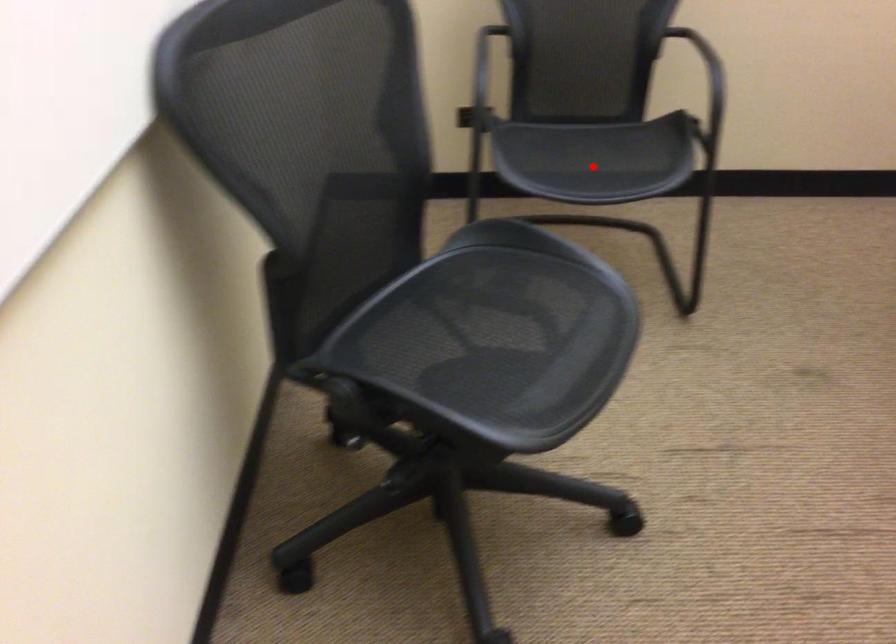
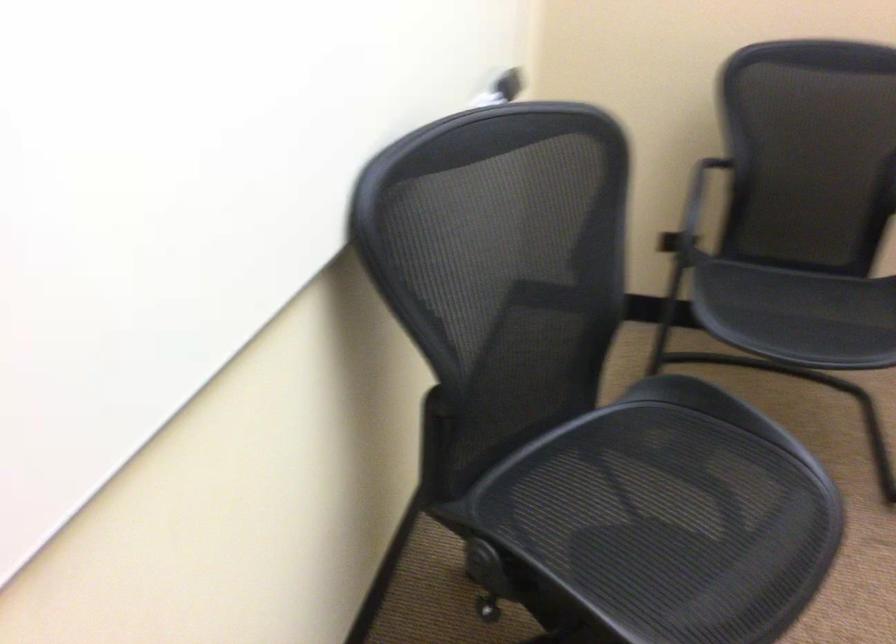
Find the pixel in the second image that matches the highlighted location in the first image.

(798, 315)